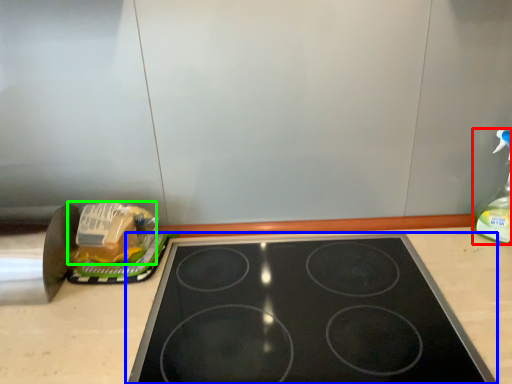
Question: Which object is positioned closest to bottle (highlighted by a red box)? Select from gas stove (highlighted by a blue box) and food (highlighted by a green box).

Choices:
 (A) gas stove
 (B) food

Answer: (A)